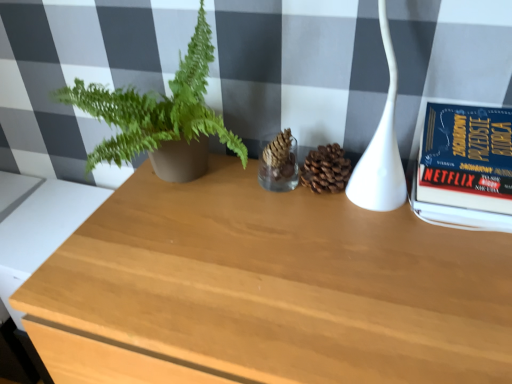
Question: Is green matte plant at left positioned before white glossy lamp at upper right?

Choices:
 (A) no
 (B) yes

Answer: (A)

Question: Is green matte plant at left placed right next to white glossy lamp at upper right?

Choices:
 (A) yes
 (B) no

Answer: (B)

Question: Is green matte plant at left aimed at white glossy lamp at upper right?

Choices:
 (A) yes
 (B) no

Answer: (B)

Question: From the image's perspective, would you say green matte plant at left is shown under white glossy lamp at upper right?

Choices:
 (A) yes
 (B) no

Answer: (A)

Question: Would you say white glossy lamp at upper right is part of green matte plant at left's contents?

Choices:
 (A) no
 (B) yes

Answer: (A)

Question: From the image's perspective, is green matte plant at left located above white glossy lamp at upper right?

Choices:
 (A) no
 (B) yes

Answer: (A)

Question: Is hardcover book at right bigger than green matte plant at left?

Choices:
 (A) no
 (B) yes

Answer: (A)

Question: Is hardcover book at right positioned far away from green matte plant at left?

Choices:
 (A) yes
 (B) no

Answer: (B)

Question: Is hardcover book at right not inside green matte plant at left?

Choices:
 (A) no
 (B) yes

Answer: (B)

Question: Considering the relative positions of hardcover book at right and green matte plant at left in the image provided, is hardcover book at right to the left of green matte plant at left from the viewer's perspective?

Choices:
 (A) no
 (B) yes

Answer: (A)

Question: Is hardcover book at right aimed at green matte plant at left?

Choices:
 (A) no
 (B) yes

Answer: (A)

Question: Does hardcover book at right have a greater height compared to green matte plant at left?

Choices:
 (A) yes
 (B) no

Answer: (B)

Question: Are wooden table at center, which appears as the second table when viewed from the left, and light wood table at lower left, the second table when ordered from right to left, making contact?

Choices:
 (A) yes
 (B) no

Answer: (B)